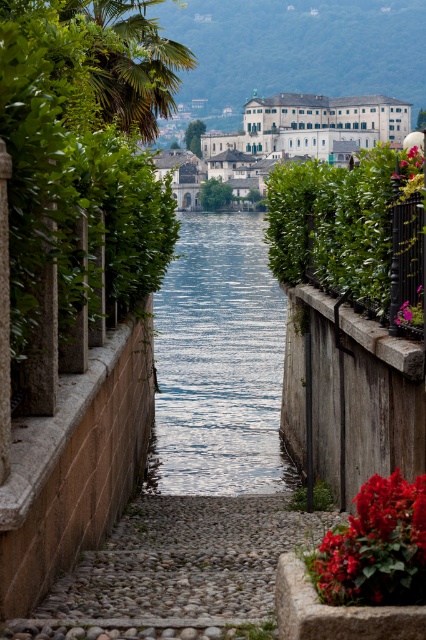
Is blue water at center further to camera compared to black wrought iron fence at right?

Yes, it is.

Does point (264, 384) come behind point (420, 260)?

Yes, it is.

Locate an element on the screen. blue water at center is located at coordinates (218, 364).

Who is higher up, blue water at center or vivid red petals at lower right?

blue water at center is above.

Is blue water at center to the left of vivid red petals at lower right from the viewer's perspective?

Yes, blue water at center is to the left of vivid red petals at lower right.

Find the location of `blue water at center`. blue water at center is located at coordinates (218, 364).

Between blue water at center and green leafy bush at right, which one has less height?

With less height is blue water at center.

Between point (244, 280) and point (339, 246), which one is positioned behind?

Positioned behind is point (244, 280).

The width and height of the screenshot is (426, 640). I want to click on blue water at center, so [218, 364].